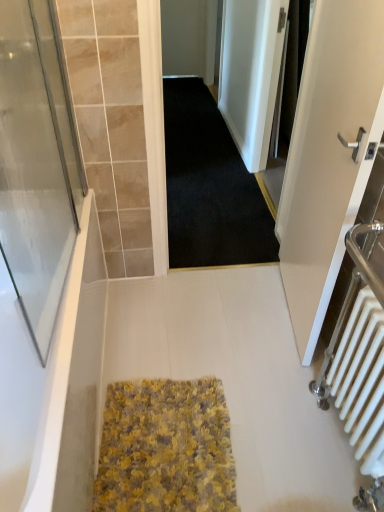
I want to click on vacant area situated below transparent glass screen door at left, placed as the first screen door when sorted from left to right (from a real-world perspective), so click(71, 295).